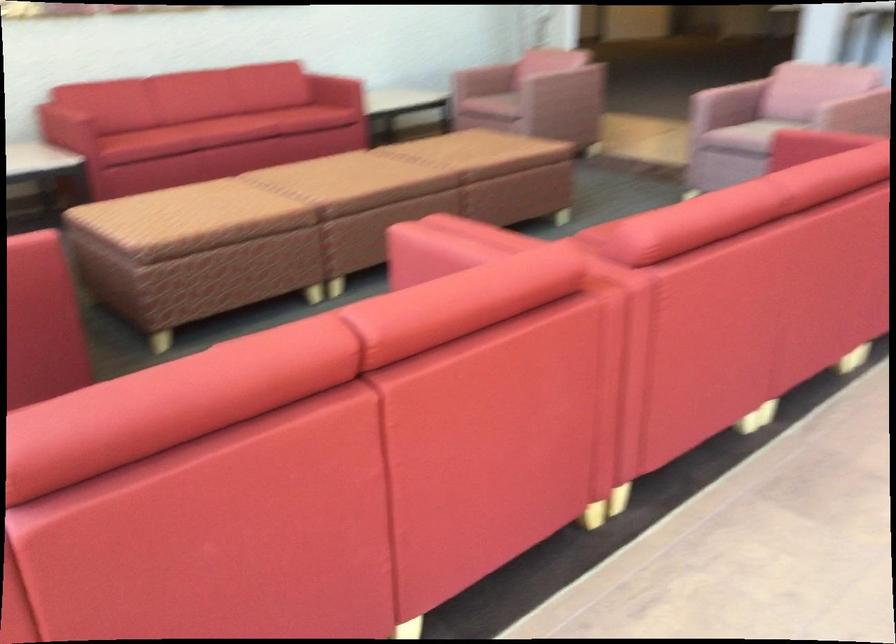
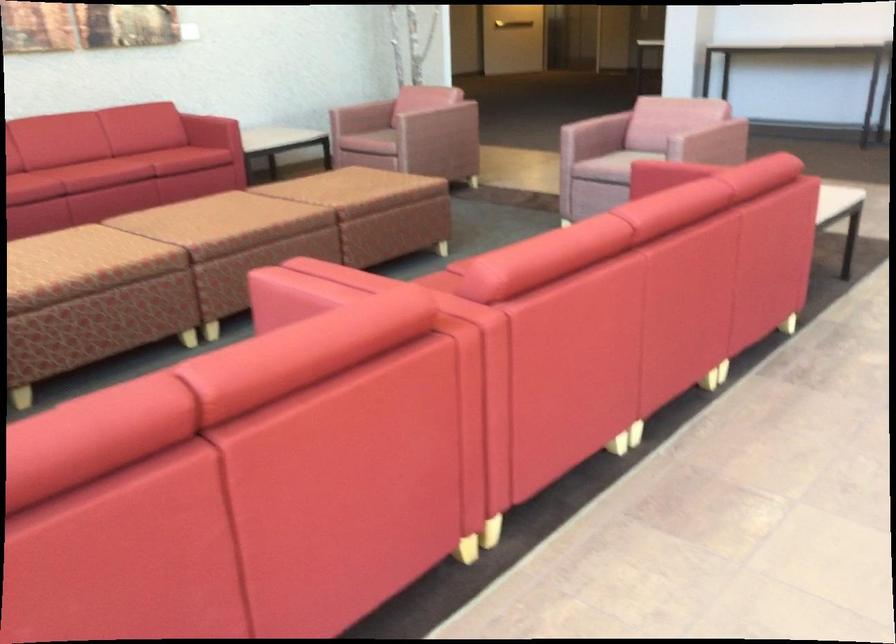
Locate, in the second image, the point that corresponds to pixel 481 80 in the first image.

(362, 117)